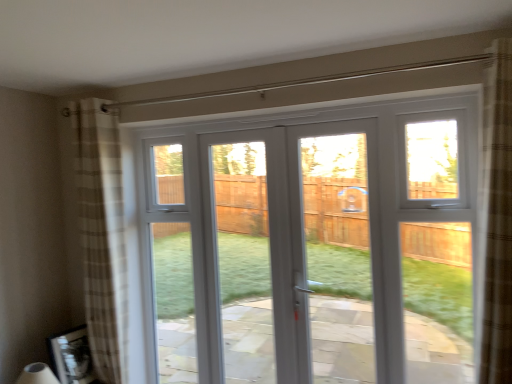
Question: Is plaid fabric curtain at left facing away from white plastic window at center?

Choices:
 (A) yes
 (B) no

Answer: (B)

Question: Is plaid fabric curtain at left touching white plastic window at center?

Choices:
 (A) no
 (B) yes

Answer: (A)

Question: Is plaid fabric curtain at left to the right of white plastic window at center from the viewer's perspective?

Choices:
 (A) yes
 (B) no

Answer: (B)

Question: From the image's perspective, is plaid fabric curtain at left beneath white plastic window at center?

Choices:
 (A) yes
 (B) no

Answer: (B)

Question: From the image's perspective, is plaid fabric curtain at left above white plastic window at center?

Choices:
 (A) no
 (B) yes

Answer: (B)

Question: In the image, is plaid fabric curtain at left on the left side or the right side of white plastic window at center?

Choices:
 (A) right
 (B) left

Answer: (B)

Question: Is point (92, 170) positioned closer to the camera than point (158, 142)?

Choices:
 (A) farther
 (B) closer

Answer: (B)

Question: Is plaid fabric curtain at left wider or thinner than white plastic window at center?

Choices:
 (A) wide
 (B) thin

Answer: (A)

Question: Considering the positions of plaid fabric curtain at left and white plastic window at center in the image, is plaid fabric curtain at left taller or shorter than white plastic window at center?

Choices:
 (A) short
 (B) tall

Answer: (B)

Question: From the image's perspective, relative to plaid fabric curtain at left, is white plastic window at center above or below?

Choices:
 (A) below
 (B) above

Answer: (A)

Question: In terms of width, does white plastic window at center look wider or thinner when compared to plaid fabric curtain at left?

Choices:
 (A) thin
 (B) wide

Answer: (A)

Question: Considering the positions of white plastic window at center and plaid fabric curtain at left in the image, is white plastic window at center bigger or smaller than plaid fabric curtain at left?

Choices:
 (A) small
 (B) big

Answer: (B)

Question: From a real-world perspective, is white plastic window at center physically located above or below plaid fabric curtain at left?

Choices:
 (A) above
 (B) below

Answer: (B)

Question: In terms of height, does white plastic door at center look taller or shorter compared to white plastic window at center?

Choices:
 (A) tall
 (B) short

Answer: (A)

Question: From a real-world perspective, is white plastic door at center physically located above or below white plastic window at center?

Choices:
 (A) above
 (B) below

Answer: (A)